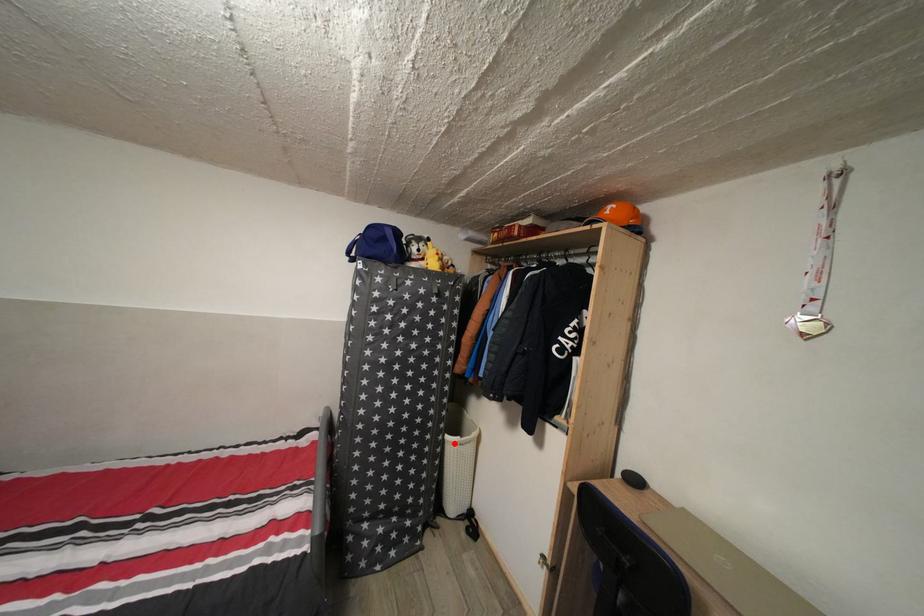
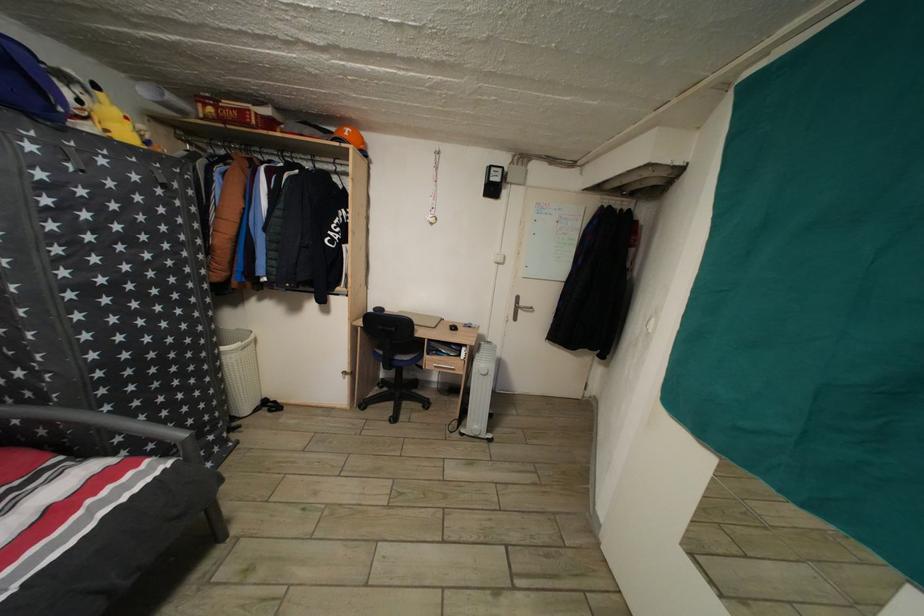
Locate, in the second image, the point that corresponds to the highlighted location in the first image.

(229, 355)